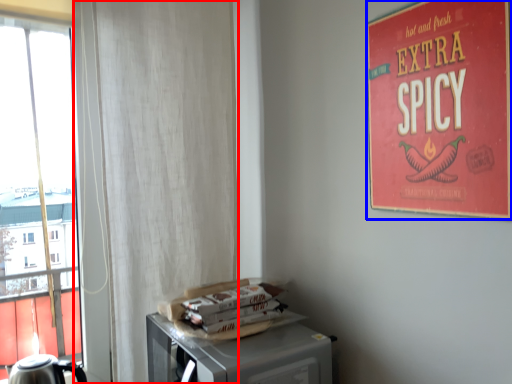
Question: Which object is further to the camera taking this photo, curtain (highlighted by a red box) or poster (highlighted by a blue box)?

Choices:
 (A) curtain
 (B) poster

Answer: (A)